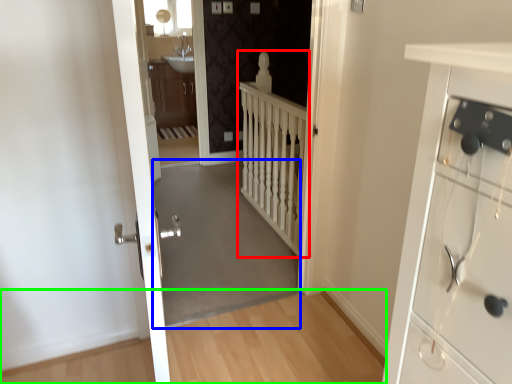
Question: Estimate the real-world distances between objects in this image. Which object is farther from balustrade (highlighted by a red box), corridor (highlighted by a blue box) or path (highlighted by a green box)?

Choices:
 (A) corridor
 (B) path

Answer: (B)